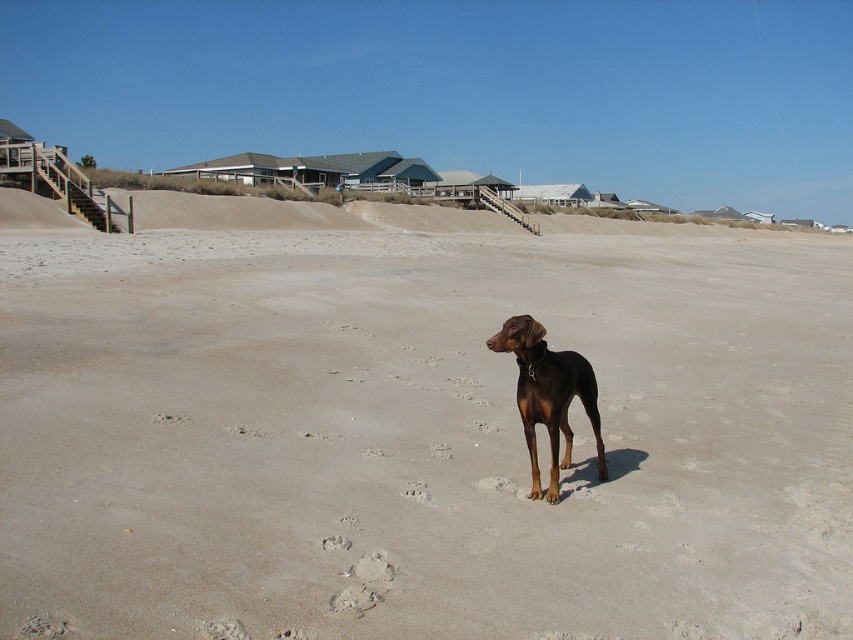
Does brown sand at center appear over brown glossy dog at center?

Yes.

Can you confirm if brown sand at center is positioned to the right of brown glossy dog at center?

In fact, brown sand at center is to the left of brown glossy dog at center.

Where is `brown sand at center`? brown sand at center is located at coordinates (415, 424).